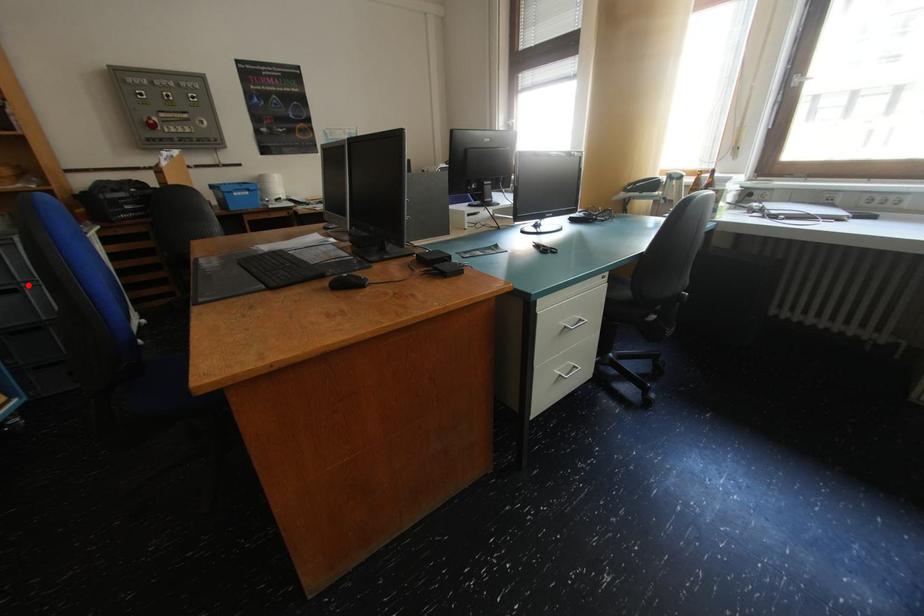
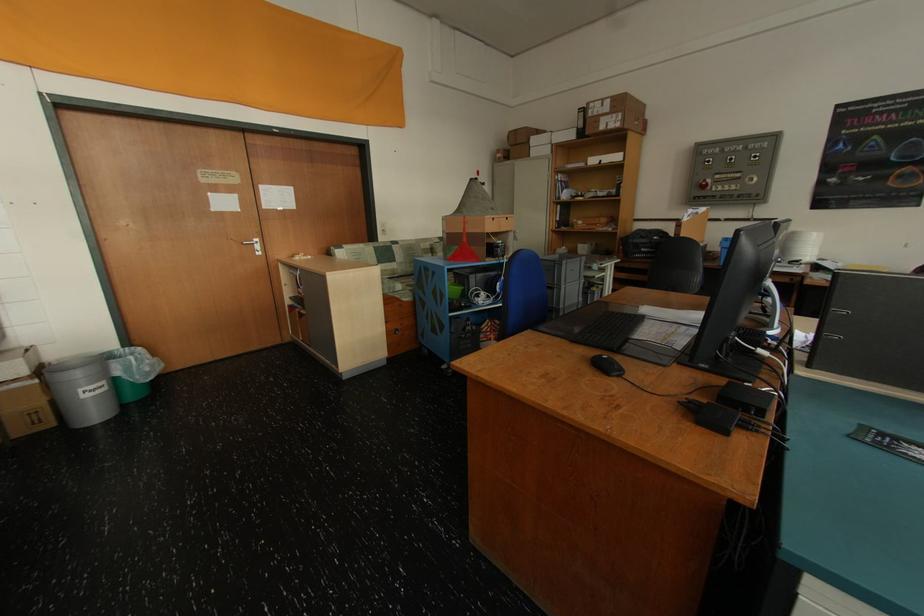
Where in the second image is the point corresponding to the highlighted location from the first image?

(563, 286)